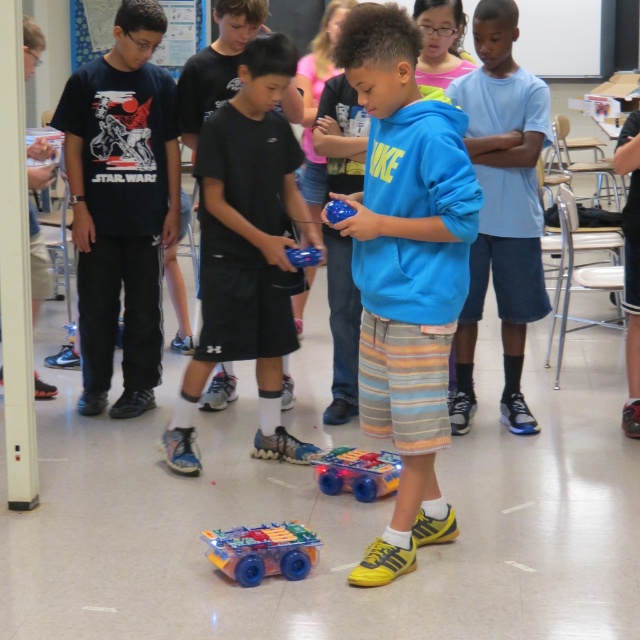
You are a child in the classroom and want to place both the translucent plastic toy car at lower center and the translucent plastic toy car at center into a rectangular box. Which car requires a wider space to fit inside the box?

The translucent plastic toy car at lower center requires a wider space because its width is larger than the translucent plastic toy car at center.

You are a photographer standing at the front of the classroom. You want to take a photo that includes both point [148,51] and point [360,468]. Which point will appear closer to the bottom of the photo?

Point [360,468] will appear closer to the bottom of the photo because it is further away from the camera compared to point [148,51].